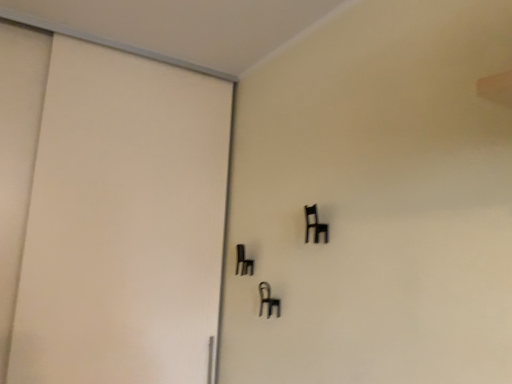
This screenshot has height=384, width=512. What do you see at coordinates (268, 299) in the screenshot?
I see `black matte chair at center, which is the second furniture in right-to-left order` at bounding box center [268, 299].

Measure the distance between point (250, 267) and camera.

5.63 feet.

Identify the location of black matte chair at center, which appears as the first furniture when viewed from the back. The width and height of the screenshot is (512, 384). (243, 261).

At what (x,y) coordinates should I click in order to perform the action: click on black plastic chair at upper right, the 3th furniture from the left. Please return your answer as a coordinate pair (x, y). Looking at the image, I should click on (315, 225).

Where is `furniture lying below the black matte chair at center, which is counted as the second furniture, starting from the top (from the image's perspective)`? This screenshot has height=384, width=512. furniture lying below the black matte chair at center, which is counted as the second furniture, starting from the top (from the image's perspective) is located at coordinates (268, 299).

Between black matte chair at center, which appears as the first furniture when viewed from the back, and black matte chair at center, the 1th furniture in the bottom-to-top sequence, which one has more height?

black matte chair at center, which appears as the first furniture when viewed from the back, is taller.

Is black matte chair at center, which ranks as the third furniture in front-to-back order, oriented towards black matte chair at center, placed as the 3th furniture when sorted from top to bottom?

No, black matte chair at center, which ranks as the third furniture in front-to-back order, is not aimed at black matte chair at center, placed as the 3th furniture when sorted from top to bottom.

In the scene shown: Is black matte chair at center, which appears as the first furniture when viewed from the back, thinner than black matte chair at center, which is the second furniture in right-to-left order?

Incorrect, the width of black matte chair at center, which appears as the first furniture when viewed from the back, is not less than that of black matte chair at center, which is the second furniture in right-to-left order.

Does matte white door at left have a larger size compared to black matte chair at center, which is the second furniture in right-to-left order?

Correct, matte white door at left is larger in size than black matte chair at center, which is the second furniture in right-to-left order.

Between point (146, 206) and point (264, 288), which one is positioned in front?

The point (264, 288) is closer to the camera.

Is matte white door at left facing towards black matte chair at center, placed as the 3th furniture when sorted from top to bottom?

Yes, matte white door at left is aimed at black matte chair at center, placed as the 3th furniture when sorted from top to bottom.

Which is closer to the camera, (80, 114) or (306, 216)?

The point (306, 216) is closer to the camera.

Is the depth of matte white door at left greater than that of black plastic chair at upper right, the 3th furniture from the left?

No, the depth of matte white door at left is less than that of black plastic chair at upper right, the 3th furniture from the left.

Is matte white door at left not close to black plastic chair at upper right, the 3th furniture from the left?

Actually, matte white door at left and black plastic chair at upper right, the 3th furniture from the left, are a little close together.

Which of these two, black matte chair at center, the 1th furniture in the bottom-to-top sequence, or matte white door at left, stands taller?

matte white door at left.

Which of these two, black matte chair at center, which ranks as the 2th furniture in back-to-front order, or matte white door at left, is wider?

With larger width is matte white door at left.

Does point (279, 303) come behind point (64, 242)?

No, (279, 303) is in front of (64, 242).

Which is correct: black plastic chair at upper right, the 1th furniture in the front-to-back sequence, is inside matte white door at left, or outside of it?

black plastic chair at upper right, the 1th furniture in the front-to-back sequence, lies outside matte white door at left.

Between black plastic chair at upper right, which is counted as the 1th furniture, starting from the top, and matte white door at left, which one has more height?

matte white door at left is taller.

Does black plastic chair at upper right, arranged as the third furniture when viewed from the back, appear on the left side of matte white door at left?

No.

Does black plastic chair at upper right, the 3th furniture positioned from the bottom, turn towards matte white door at left?

No, black plastic chair at upper right, the 3th furniture positioned from the bottom, is not turned towards matte white door at left.

Considering the positions of point (266, 287) and point (308, 238), is point (266, 287) closer or farther from the camera than point (308, 238)?

Point (266, 287) appears to be farther away from the viewer than point (308, 238).

From a real-world perspective, is black matte chair at center, placed as the 3th furniture when sorted from top to bottom, over black plastic chair at upper right, the 3th furniture from the left?

No.

Where is `furniture that is the 2nd object located below the black plastic chair at upper right, which is counted as the 1th furniture, starting from the top (from the image's perspective)`? The height and width of the screenshot is (384, 512). furniture that is the 2nd object located below the black plastic chair at upper right, which is counted as the 1th furniture, starting from the top (from the image's perspective) is located at coordinates (268, 299).

Which is in front, point (313, 216) or point (246, 263)?

The point (313, 216) is closer to the camera.

Could you tell me if black plastic chair at upper right, which appears as the 1th furniture when viewed from the right, is facing black matte chair at center, which is counted as the second furniture, starting from the top?

No, black plastic chair at upper right, which appears as the 1th furniture when viewed from the right, is not facing towards black matte chair at center, which is counted as the second furniture, starting from the top.

In the scene shown: From a real-world perspective, is black plastic chair at upper right, which appears as the 1th furniture when viewed from the right, below black matte chair at center, the 1th furniture when ordered from left to right?

No, from a real-world perspective, black plastic chair at upper right, which appears as the 1th furniture when viewed from the right, is not under black matte chair at center, the 1th furniture when ordered from left to right.

In order to click on furniture that appears behind the black matte chair at center, which is the second furniture in right-to-left order in this screenshot , I will do `click(243, 261)`.

Image resolution: width=512 pixels, height=384 pixels. I want to click on door that is above the black matte chair at center, acting as the second furniture starting from the front (from a real-world perspective), so click(122, 222).

Considering their positions, is black matte chair at center, positioned as the second furniture in bottom-to-top order, positioned further to black matte chair at center, which ranks as the 2th furniture in back-to-front order, than black plastic chair at upper right, the 1th furniture in the front-to-back sequence?

Answer: Among the two, black plastic chair at upper right, the 1th furniture in the front-to-back sequence, is located further to black matte chair at center, which ranks as the 2th furniture in back-to-front order.

Estimate the real-world distances between objects in this image. Which object is further from matte white door at left, black plastic chair at upper right, the 3th furniture positioned from the bottom, or black matte chair at center, the 1th furniture in the bottom-to-top sequence?

Based on the image, black plastic chair at upper right, the 3th furniture positioned from the bottom, appears to be further to matte white door at left.

When comparing their distances from black matte chair at center, the 1th furniture when ordered from left to right, does matte white door at left or black matte chair at center, the 2th furniture from the left, seem further?

The object further to black matte chair at center, the 1th furniture when ordered from left to right, is matte white door at left.

When comparing their distances from black plastic chair at upper right, the 3th furniture positioned from the bottom, does black matte chair at center, which is the second furniture in right-to-left order, or black matte chair at center, which ranks as the third furniture in front-to-back order, seem closer?

black matte chair at center, which is the second furniture in right-to-left order, is closer to black plastic chair at upper right, the 3th furniture positioned from the bottom.

Considering their positions, is black matte chair at center, the 2th furniture from the left, positioned further to matte white door at left than black plastic chair at upper right, which is counted as the 1th furniture, starting from the top?

black plastic chair at upper right, which is counted as the 1th furniture, starting from the top, lies further to matte white door at left than the other object.

Consider the image. Based on their spatial positions, is black matte chair at center, which ranks as the third furniture in front-to-back order, or matte white door at left closer to black plastic chair at upper right, arranged as the third furniture when viewed from the back?

black matte chair at center, which ranks as the third furniture in front-to-back order, lies closer to black plastic chair at upper right, arranged as the third furniture when viewed from the back, than the other object.

From the image, which object appears to be farther from black matte chair at center, acting as the second furniture starting from the front, black plastic chair at upper right, the 3th furniture from the left, or matte white door at left?

matte white door at left lies further to black matte chair at center, acting as the second furniture starting from the front, than the other object.

From the image, which object appears to be farther from black matte chair at center, which ranks as the 2th furniture in back-to-front order, matte white door at left or black matte chair at center, which ranks as the third furniture in front-to-back order?

Based on the image, matte white door at left appears to be further to black matte chair at center, which ranks as the 2th furniture in back-to-front order.

At what (x,y) coordinates should I click in order to perform the action: click on furniture situated between matte white door at left and black matte chair at center, the 2th furniture from the left, from left to right. Please return your answer as a coordinate pair (x, y). Looking at the image, I should click on (243, 261).

The width and height of the screenshot is (512, 384). I want to click on furniture between black plastic chair at upper right, which appears as the 1th furniture when viewed from the right, and black matte chair at center, the 1th furniture when ordered from left to right, from front to back, so click(268, 299).